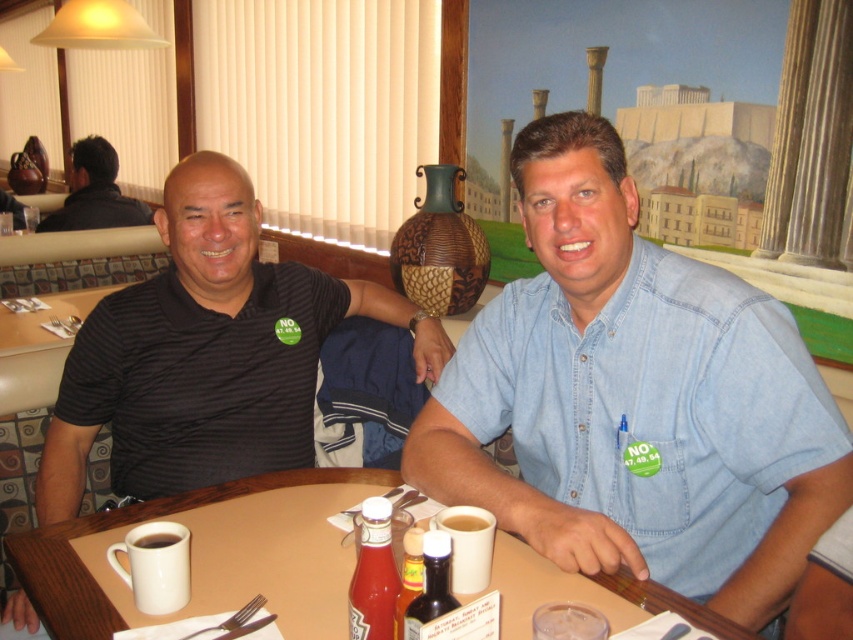
Is point (511, 540) closer to viewer compared to point (64, 198)?

Yes, it is in front of point (64, 198).

Is wooden table at center taller than black shirt at upper left?

No.

At what (x,y) coordinates should I click in order to perform the action: click on wooden table at center. Please return your answer as a coordinate pair (x, y). The image size is (853, 640). Looking at the image, I should click on (x=122, y=525).

Does denim shirt at center have a smaller size compared to translucent glass bottle at center?

No, denim shirt at center is not smaller than translucent glass bottle at center.

Which of these two, denim shirt at center or translucent glass bottle at center, stands shorter?

With less height is translucent glass bottle at center.

Describe the element at coordinates (635, 397) in the screenshot. I see `denim shirt at center` at that location.

Image resolution: width=853 pixels, height=640 pixels. What are the coordinates of `denim shirt at center` in the screenshot? It's located at [x=635, y=397].

Is the position of black striped polo shirt at left more distant than that of black shirt at upper left?

No, it is in front of black shirt at upper left.

Does black striped polo shirt at left have a greater height compared to black shirt at upper left?

Indeed, black striped polo shirt at left has a greater height compared to black shirt at upper left.

Does point (318, 346) come closer to viewer compared to point (85, 205)?

Yes, point (318, 346) is in front of point (85, 205).

Find the location of a particular element. This screenshot has height=640, width=853. black striped polo shirt at left is located at coordinates tap(207, 353).